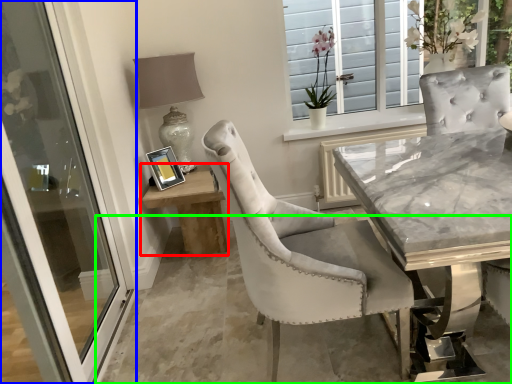
Question: Which object is the farthest from table (highlighted by a red box)? Choose among these: door (highlighted by a blue box) or concrete (highlighted by a green box).

Choices:
 (A) door
 (B) concrete

Answer: (A)